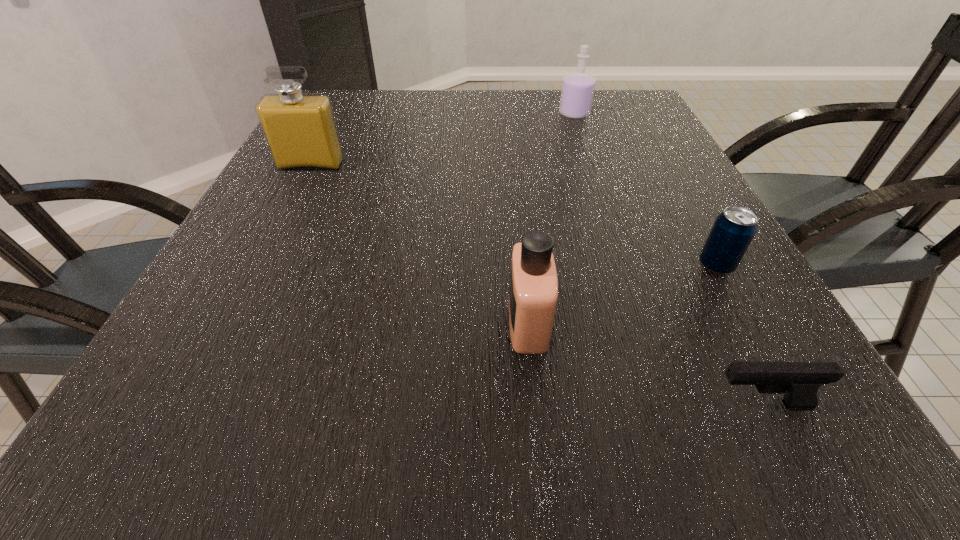
Image resolution: width=960 pixels, height=540 pixels. Identify the location of the leftmost object. (300, 129).

What are the coordinates of `the tallest perfume` in the screenshot? It's located at (300, 129).

Identify the location of the third object from left to right. The image size is (960, 540). (578, 87).

At what (x,y) coordinates should I click in order to perform the action: click on the farthest perfume. Please return your answer as a coordinate pair (x, y). The height and width of the screenshot is (540, 960). Looking at the image, I should click on (578, 87).

You are a GUI agent. You are given a task and a screenshot of the screen. Output one action in this format:
    pyautogui.click(x=<x>, y=<y>)
    Task: Click on the fourth object from right to left
    This screenshot has width=960, height=540.
    Given the screenshot: What is the action you would take?
    pyautogui.click(x=533, y=293)

Image resolution: width=960 pixels, height=540 pixels. I want to click on the second perfume from right to left, so click(533, 293).

The height and width of the screenshot is (540, 960). Identify the location of the third nearest object. (733, 230).

Where is `soda can`? The image size is (960, 540). soda can is located at coordinates (733, 230).

At what (x,y) coordinates should I click in order to perform the action: click on the shortest object. Please return your answer as a coordinate pair (x, y). Looking at the image, I should click on (799, 381).

The height and width of the screenshot is (540, 960). Identify the location of pistol. (799, 381).